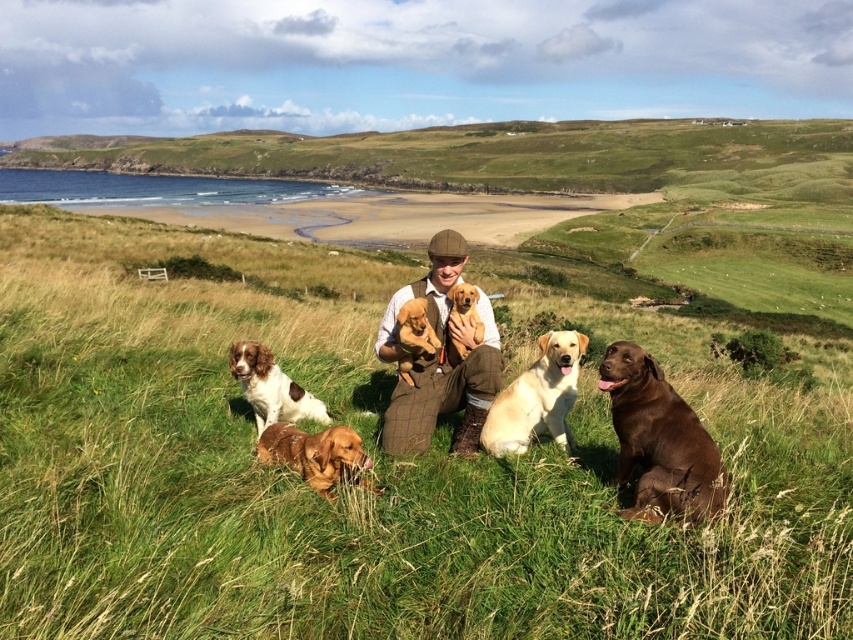
Is green grassy at center closer to camera compared to golden brown fur at center?

Yes, green grassy at center is in front of golden brown fur at center.

Is green grassy at center behind golden brown fur at center?

No, green grassy at center is in front of golden brown fur at center.

Does point (271, 611) come in front of point (326, 452)?

Yes, point (271, 611) is closer to viewer.

Locate an element on the screen. This screenshot has height=640, width=853. green grassy at center is located at coordinates (357, 488).

Where is `brown tweed suit at center`? brown tweed suit at center is located at coordinates (439, 360).

Is brown tweed suit at center positioned before light yellow fur at center?

No, brown tweed suit at center is further to the viewer.

Is point (480, 378) closer to camera compared to point (550, 353)?

No, it is behind (550, 353).

Find the location of a particular element. The width and height of the screenshot is (853, 640). brown tweed suit at center is located at coordinates (439, 360).

Between green grassy at center and brown speckled fur dog at lower left, which one appears on the right side from the viewer's perspective?

From the viewer's perspective, brown speckled fur dog at lower left appears more on the right side.

Is green grassy at center to the right of brown speckled fur dog at lower left from the viewer's perspective?

In fact, green grassy at center is to the left of brown speckled fur dog at lower left.

Measure the distance between point (186, 570) and camera.

Point (186, 570) is 3.08 meters away from camera.

Find the location of a particular element. Image resolution: width=853 pixels, height=640 pixels. green grassy at center is located at coordinates (357, 488).